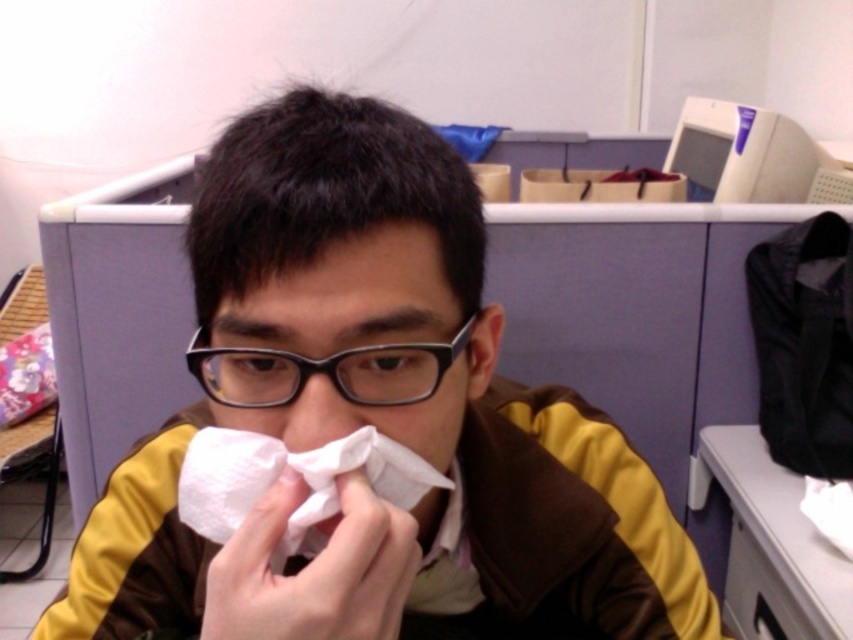
Can you confirm if brown/yellow fabric jacket at center is positioned below white paper handkerchief at center?

Correct, brown/yellow fabric jacket at center is located below white paper handkerchief at center.

Who is more forward, (305, 250) or (184, 461)?

Point (305, 250) is in front.

Where is `brown/yellow fabric jacket at center`? brown/yellow fabric jacket at center is located at coordinates (373, 417).

Which is more to the right, white paper handkerchief at center or black plastic glasses at center?

Positioned to the right is white paper handkerchief at center.

Does point (381, 467) lie behind point (248, 360)?

Yes, point (381, 467) is farther from viewer.

Is point (207, 525) positioned behind point (364, 380)?

Yes, point (207, 525) is behind point (364, 380).

Where is `white paper handkerchief at center`? white paper handkerchief at center is located at coordinates (306, 484).

Between brown/yellow fabric jacket at center and black plastic glasses at center, which one has more height?

brown/yellow fabric jacket at center is taller.

The height and width of the screenshot is (640, 853). Find the location of `brown/yellow fabric jacket at center`. brown/yellow fabric jacket at center is located at coordinates (373, 417).